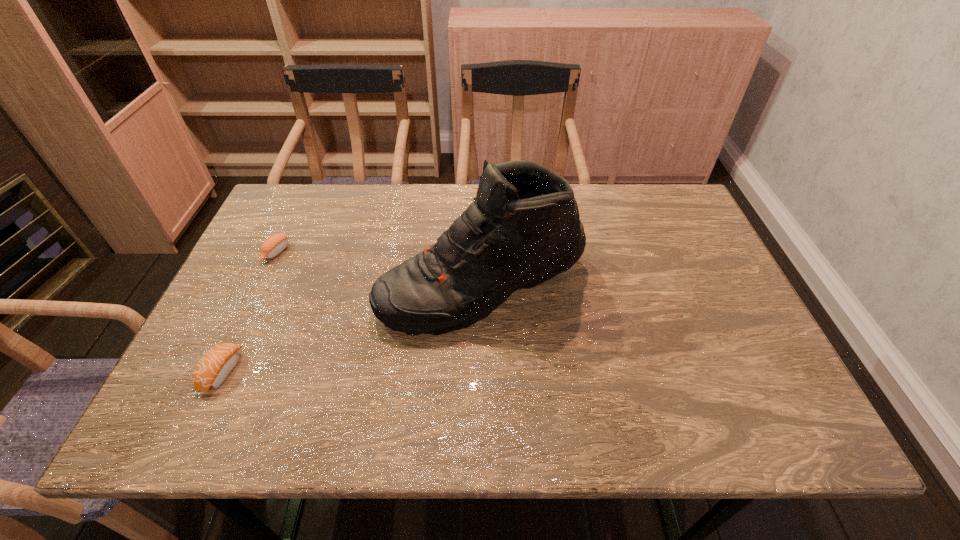
You are a GUI agent. You are given a task and a screenshot of the screen. Output one action in this format:
    pyautogui.click(x=<x>, y=<y>)
    Task: Click on the unoccupied area between the nearer sushi and the farther sushi
    The height and width of the screenshot is (540, 960).
    Given the screenshot: What is the action you would take?
    pyautogui.click(x=249, y=312)

Locate an element on the screen. The width and height of the screenshot is (960, 540). vacant space that's between the ski boot and the nearer sushi is located at coordinates (352, 329).

You are a GUI agent. You are given a task and a screenshot of the screen. Output one action in this format:
    pyautogui.click(x=<x>, y=<y>)
    Task: Click on the empty space that is in between the rightmost object and the farther sushi
    This screenshot has width=960, height=540.
    Given the screenshot: What is the action you would take?
    pyautogui.click(x=379, y=270)

Locate an element on the screen. The height and width of the screenshot is (540, 960). the closest object to the nearest object is located at coordinates (523, 228).

Select which object appears as the second closest to the nearer sushi. Please provide its 2D coordinates. Your answer should be formatted as a tuple, i.e. [(x, y)], where the tuple contains the x and y coordinates of a point satisfying the conditions above.

[(275, 244)]

Image resolution: width=960 pixels, height=540 pixels. Find the location of `vacant point that satisfies the following two spatial constraints: 1. on the back side of the rightmost object; 2. on the left side of the nearer sushi`. vacant point that satisfies the following two spatial constraints: 1. on the back side of the rightmost object; 2. on the left side of the nearer sushi is located at coordinates (261, 288).